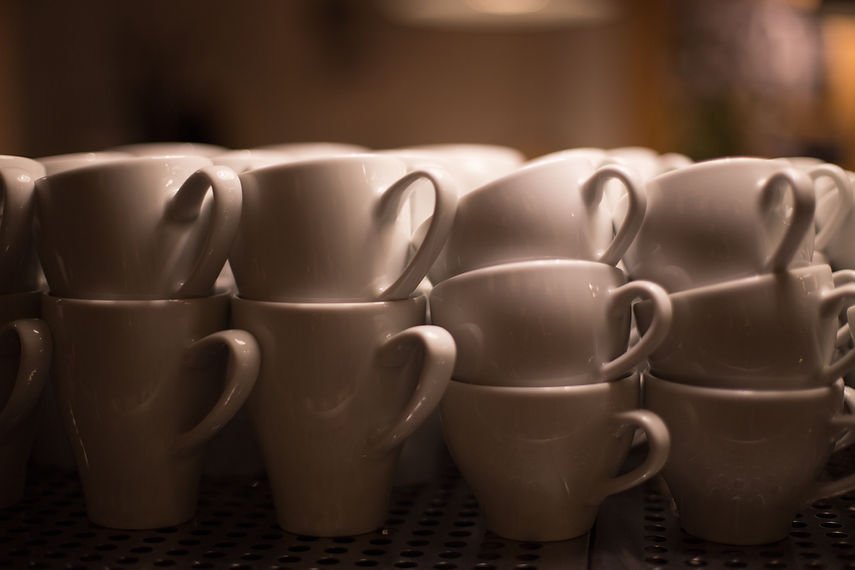
This screenshot has width=855, height=570. I want to click on porcelain cups, so click(x=715, y=228), click(x=718, y=323), click(x=739, y=431), click(x=563, y=431), click(x=529, y=342), click(x=534, y=205), click(x=323, y=213), click(x=327, y=378), click(x=121, y=390), click(x=99, y=238).